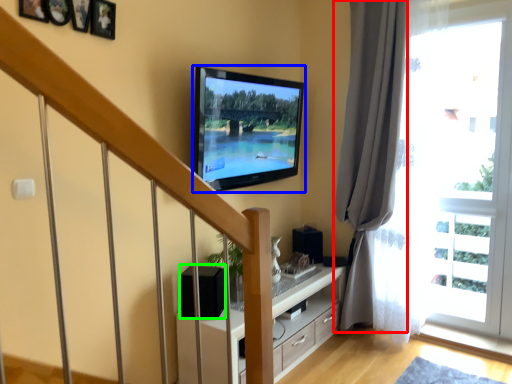
Question: Based on their relative distances, which object is farther from curtain (highlighted by a red box)? Choose from television (highlighted by a blue box) and speaker (highlighted by a green box).

Choices:
 (A) television
 (B) speaker

Answer: (B)